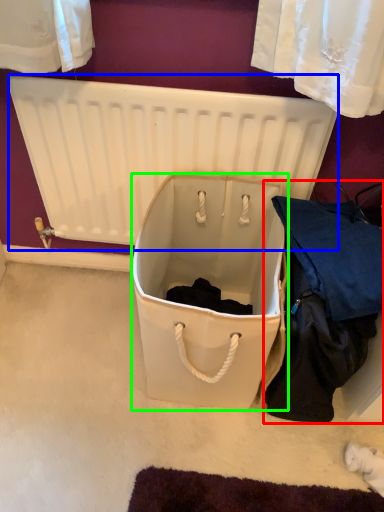
Question: Which object is the closest to the clothing (highlighted by a red box)? Choose among these: radiator (highlighted by a blue box) or storage box (highlighted by a green box).

Choices:
 (A) radiator
 (B) storage box

Answer: (B)